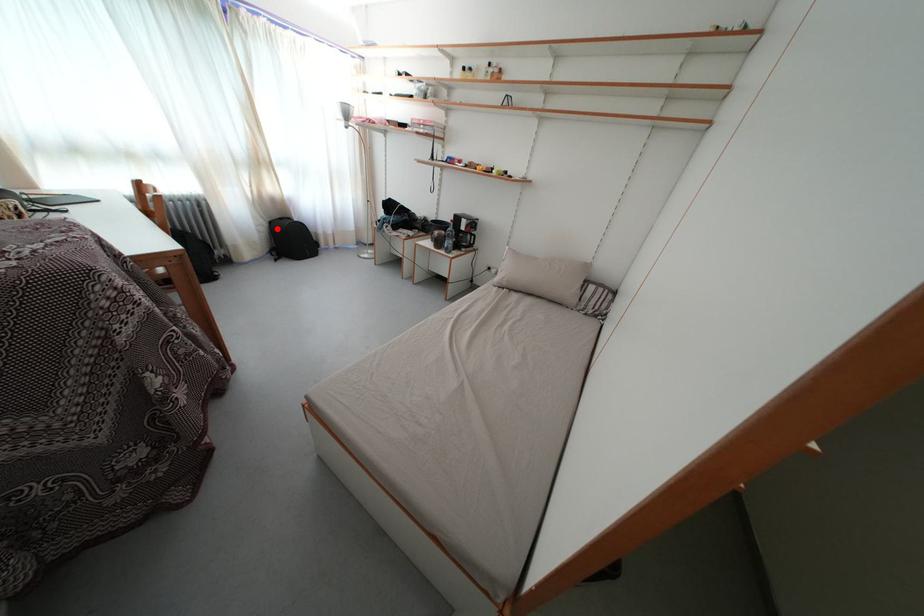
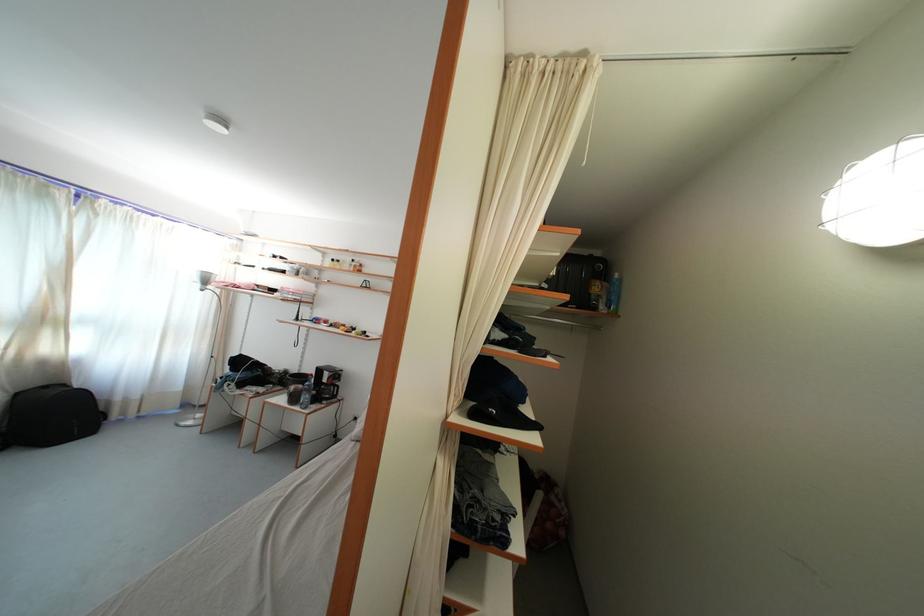
Question: A red point is marked in image1. In image2, is the corresponding 3D point closer to the camera or farther? Reply with the corresponding letter.

Choices:
 (A) The corresponding 3D point is closer.
 (B) The corresponding 3D point is farther.

Answer: (B)